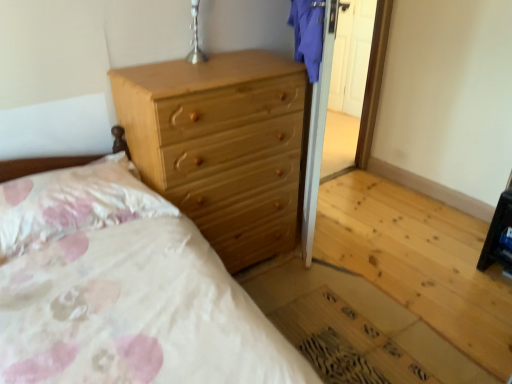
Question: Looking at the image, does natural wood chest of drawers at upper center seem bigger or smaller compared to silver metallic table lamp at upper center?

Choices:
 (A) big
 (B) small

Answer: (A)

Question: Would you say natural wood chest of drawers at upper center is to the left or to the right of silver metallic table lamp at upper center in the picture?

Choices:
 (A) left
 (B) right

Answer: (B)

Question: Considering the real-world distances, which object is farthest from the fluffy white pillow at upper left?

Choices:
 (A) silver metallic table lamp at upper center
 (B) natural wood chest of drawers at upper center

Answer: (A)

Question: Estimate the real-world distances between objects in this image. Which object is farther from the fluffy white pillow at upper left?

Choices:
 (A) silver metallic table lamp at upper center
 (B) natural wood chest of drawers at upper center

Answer: (A)